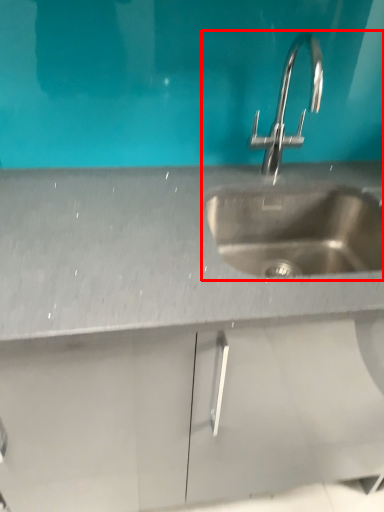
Question: From the image's perspective, where is sink (annotated by the red box) located in relation to sink in the image?

Choices:
 (A) below
 (B) above

Answer: (B)